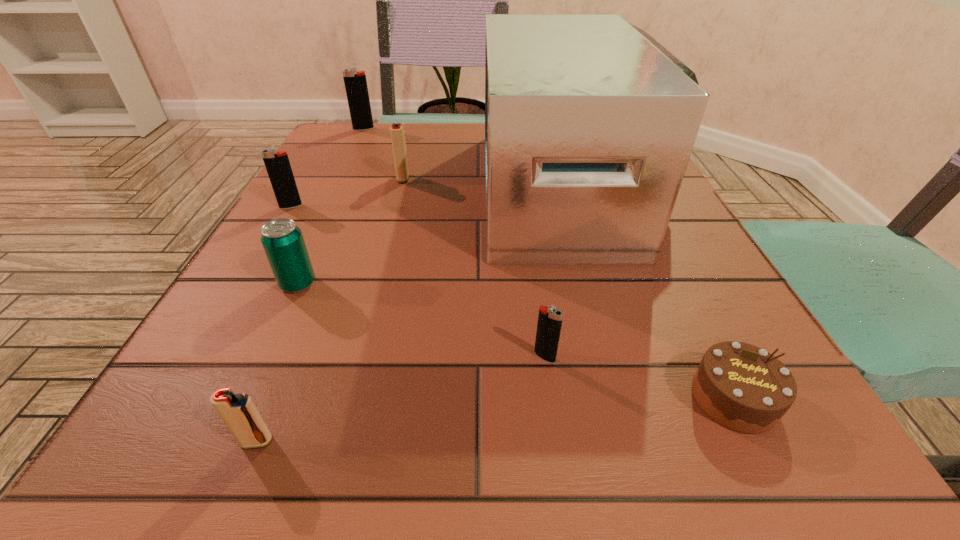
The width and height of the screenshot is (960, 540). I want to click on white microwave oven, so click(x=590, y=122).

Find the location of a particular element. The image size is (960, 540). the tallest object is located at coordinates (590, 122).

At what (x,y) coordinates should I click in order to perform the action: click on the seventh shortest object. Please return your answer as a coordinate pair (x, y). This screenshot has width=960, height=540. Looking at the image, I should click on (356, 87).

The height and width of the screenshot is (540, 960). What are the coordinates of `the fourth igniter from right to left` in the screenshot? It's located at (356, 87).

Locate an element on the screen. The height and width of the screenshot is (540, 960). the third farthest igniter is located at coordinates (278, 167).

Where is `the leftmost object`? the leftmost object is located at coordinates (278, 167).

The height and width of the screenshot is (540, 960). Identify the location of the bigger red igniter. (397, 132).

Image resolution: width=960 pixels, height=540 pixels. I want to click on the fifth object from left to right, so click(x=397, y=132).

At what (x,y) coordinates should I click in order to perform the action: click on teal beer can. Please return your answer as a coordinate pair (x, y). Looking at the image, I should click on (283, 242).

Locate an element on the screen. Image resolution: width=960 pixels, height=540 pixels. beer can is located at coordinates (283, 242).